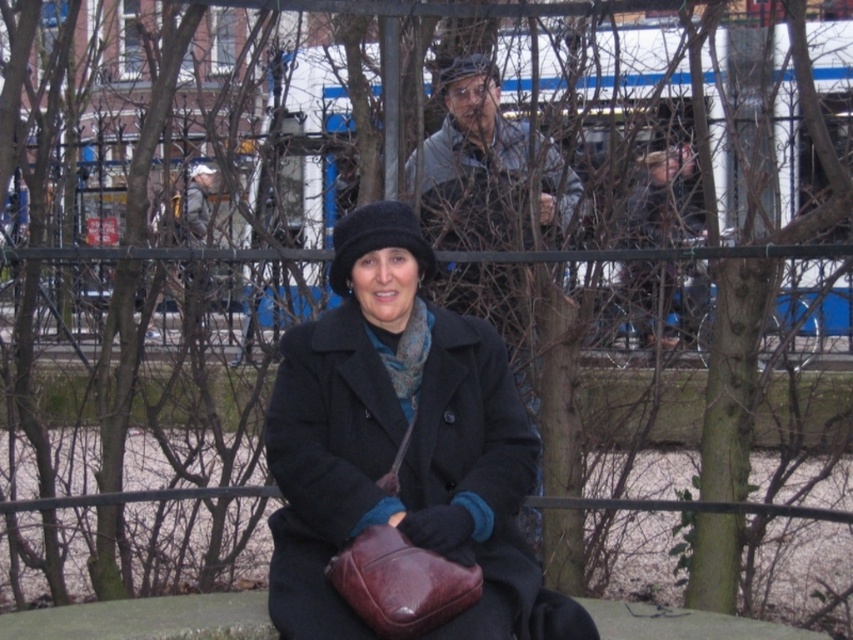
Question: Considering the relative positions of matte black coat at center and gray woolen jacket at upper center in the image provided, where is matte black coat at center located with respect to gray woolen jacket at upper center?

Choices:
 (A) below
 (B) above

Answer: (A)

Question: Can you confirm if matte black coat at center is positioned to the right of gray woolen jacket at upper center?

Choices:
 (A) yes
 (B) no

Answer: (B)

Question: Which point is farther from the camera taking this photo?

Choices:
 (A) (412, 378)
 (B) (581, 189)

Answer: (B)

Question: Among these objects, which one is nearest to the camera?

Choices:
 (A) matte black coat at center
 (B) gray woolen jacket at upper center

Answer: (A)

Question: Which point is farther to the camera?

Choices:
 (A) matte black coat at center
 (B) gray woolen jacket at upper center

Answer: (B)

Question: Is matte black coat at center to the right of gray woolen jacket at upper center from the viewer's perspective?

Choices:
 (A) no
 (B) yes

Answer: (A)